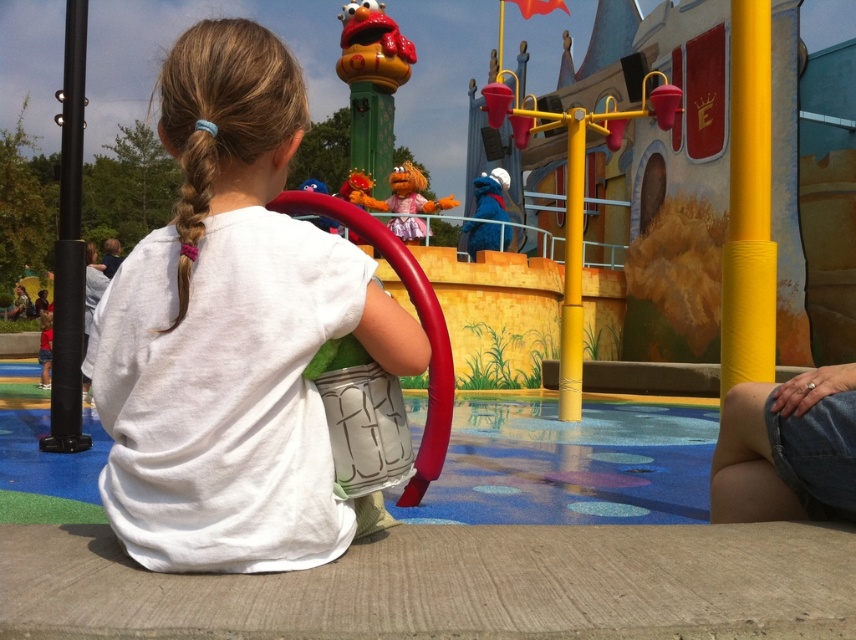
Is denim shorts at lower right closer to the viewer compared to blue plush toy at upper center?

Yes, denim shorts at lower right is in front of blue plush toy at upper center.

Can you confirm if denim shorts at lower right is taller than blue plush toy at upper center?

In fact, denim shorts at lower right may be shorter than blue plush toy at upper center.

What are the coordinates of `denim shorts at lower right` in the screenshot? It's located at (786, 449).

Locate an element on the screen. denim shorts at lower right is located at coordinates (786, 449).

Based on the photo, is white cotton shirt at center thinner than blonde hair at upper left?

Correct, white cotton shirt at center's width is less than blonde hair at upper left's.

Is white cotton shirt at center closer to the viewer compared to blonde hair at upper left?

That is True.

Locate an element on the screen. white cotton shirt at center is located at coordinates point(232,332).

This screenshot has height=640, width=856. In order to click on white cotton shirt at center in this screenshot , I will do `click(232, 332)`.

Who is higher up, white cotton shirt at center or rubberized red ring at upper center?

rubberized red ring at upper center is above.

Does white cotton shirt at center appear under rubberized red ring at upper center?

Correct, white cotton shirt at center is located below rubberized red ring at upper center.

Find the location of `white cotton shirt at center`. white cotton shirt at center is located at coordinates (232, 332).

Locate an element on the screen. This screenshot has width=856, height=640. white cotton shirt at center is located at coordinates (232, 332).